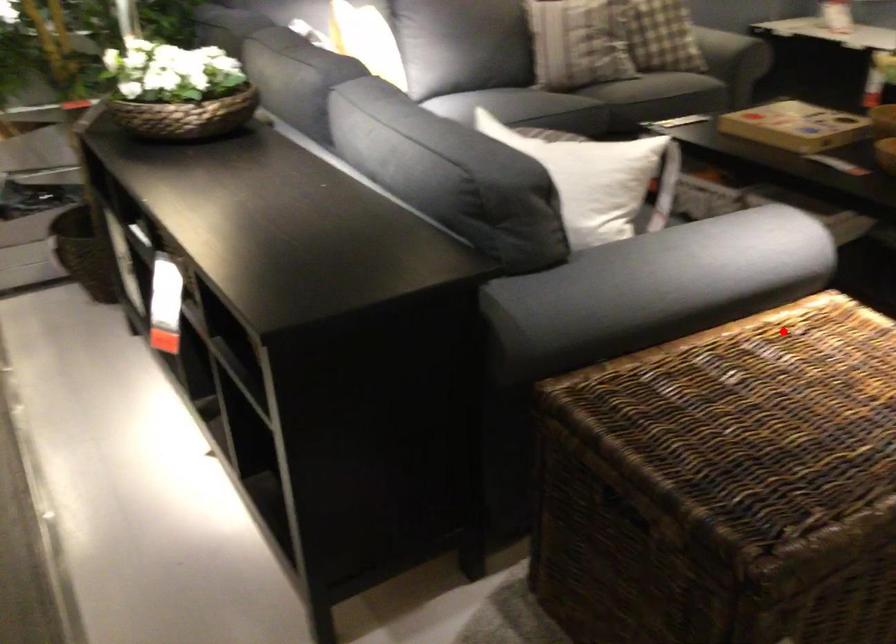
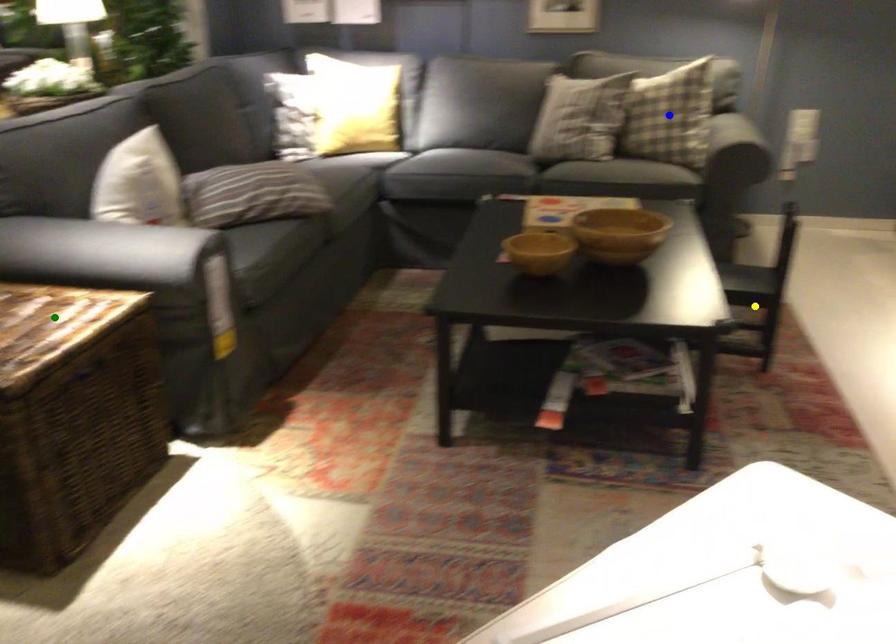
Question: I am providing you with two images of the same scene from different viewpoints. A red point is marked on the first image. You are given multiple points on the second image. Which point in image 2 represents the same 3d spot as the red point in image 1?

Choices:
 (A) green point
 (B) yellow point
 (C) blue point

Answer: (A)